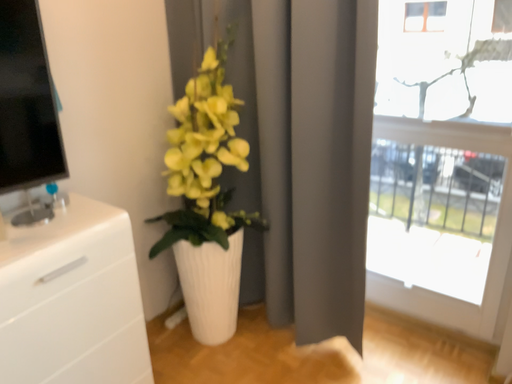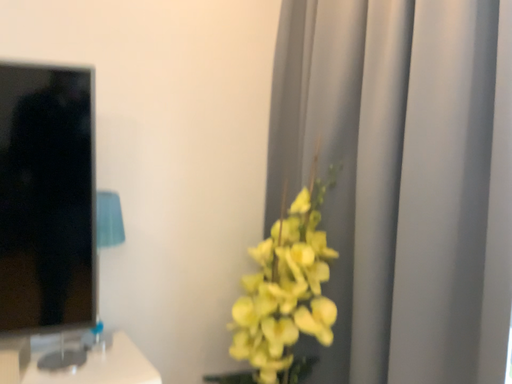
Question: How did the camera likely rotate when shooting the video?

Choices:
 (A) rotated upward
 (B) rotated downward

Answer: (A)